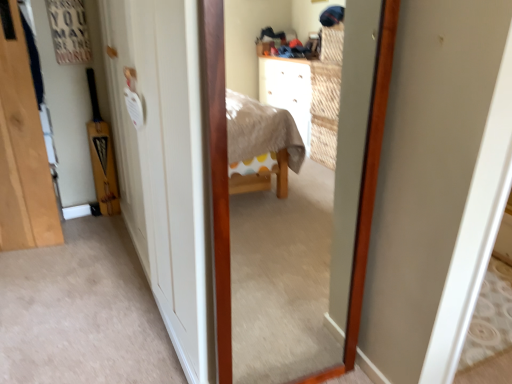
What is the approximate width of wooden mirror at center?

1.68 inches.

Describe the element at coordinates (289, 218) in the screenshot. I see `wooden mirror at center` at that location.

Where is `wooden mirror at center`? wooden mirror at center is located at coordinates (289, 218).

Find the location of a particular element. The height and width of the screenshot is (384, 512). wooden mirror at center is located at coordinates (289, 218).